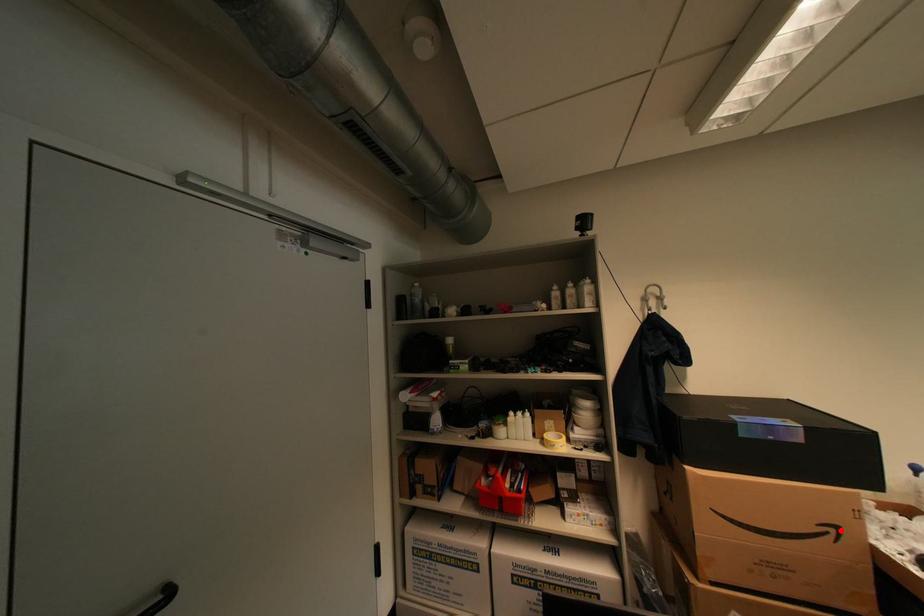
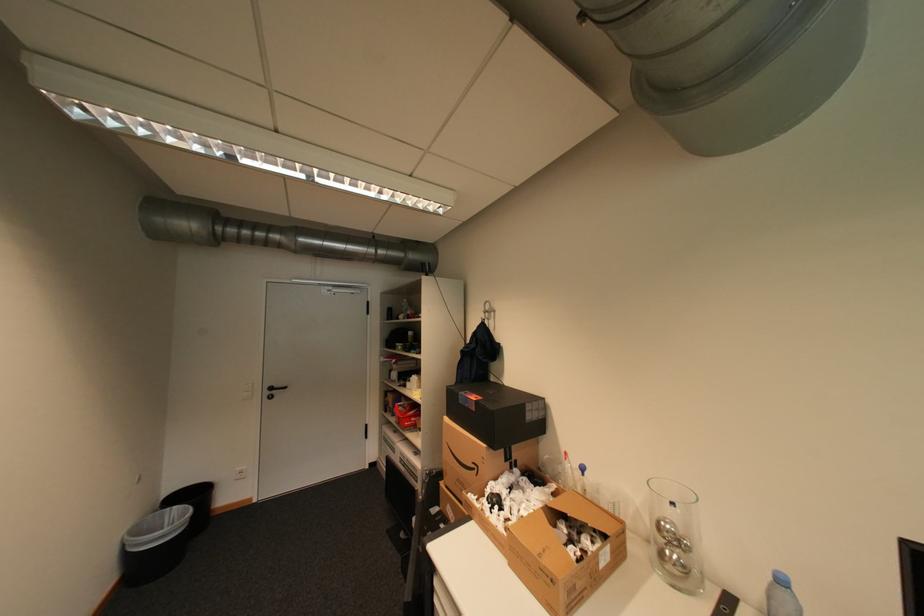
Question: I am providing you with two images of the same scene from different viewpoints. In image1, a red point is highlighted. Considering the same 3D point in image2, which of the following is correct?

Choices:
 (A) It is closer
 (B) It is farther

Answer: (B)